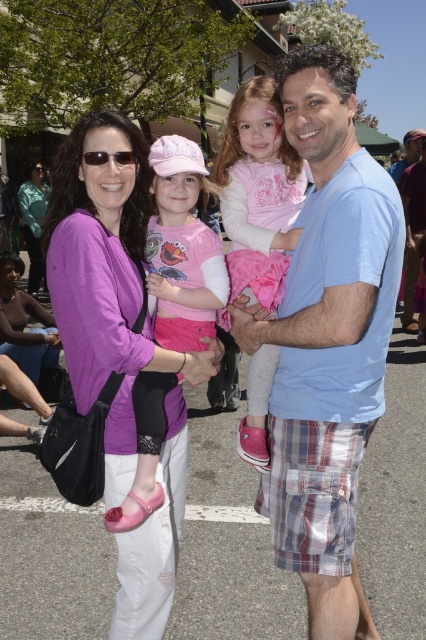
Which of these two, purple soft fabric shirt at upper left or pink fleece jacket at center, stands shorter?

Standing shorter between the two is pink fleece jacket at center.

Does purple soft fabric shirt at upper left have a lesser width compared to pink fleece jacket at center?

In fact, purple soft fabric shirt at upper left might be wider than pink fleece jacket at center.

Is point (51, 296) farther from viewer compared to point (299, 168)?

That is False.

This screenshot has height=640, width=426. What are the coordinates of `purple soft fabric shirt at upper left` in the screenshot? It's located at (108, 282).

Does pink fabric dress at center have a smaller size compared to matte teal jacket at upper left?

Yes.

Can you confirm if pink fabric dress at center is wider than matte teal jacket at upper left?

No.

Image resolution: width=426 pixels, height=640 pixels. What do you see at coordinates (183, 248) in the screenshot?
I see `pink fabric dress at center` at bounding box center [183, 248].

The height and width of the screenshot is (640, 426). Find the location of `pink fabric dress at center`. pink fabric dress at center is located at coordinates (183, 248).

Which is above, pink fleece jacket at center or pink fabric dress at center?

pink fleece jacket at center

This screenshot has width=426, height=640. What do you see at coordinates (259, 192) in the screenshot?
I see `pink fleece jacket at center` at bounding box center [259, 192].

Which is in front, point (230, 132) or point (172, 257)?

Point (172, 257) is in front.

Locate an element on the screen. The width and height of the screenshot is (426, 640). pink fleece jacket at center is located at coordinates (259, 192).